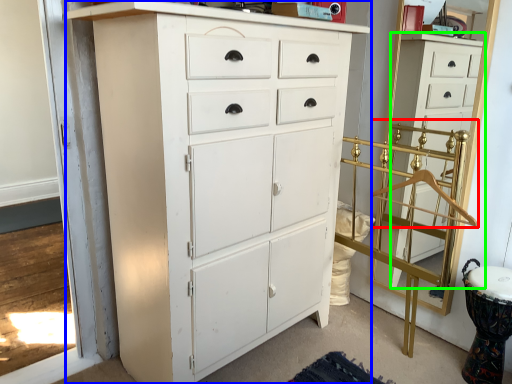
Question: Which is farther away from hanger (highlighted by a red box)? chest of drawers (highlighted by a blue box) or chest of drawers (highlighted by a green box)?

Choices:
 (A) chest of drawers
 (B) chest of drawers

Answer: (A)